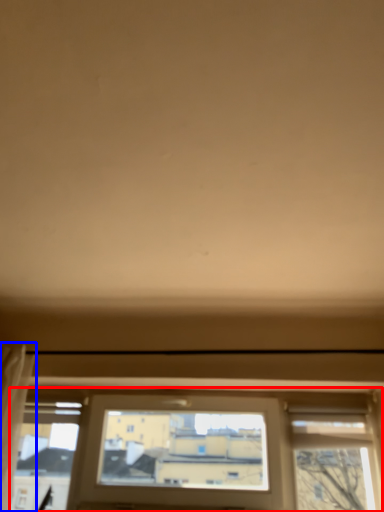
Question: Which of the following is the farthest to the observer, window (highlighted by a red box) or curtain (highlighted by a blue box)?

Choices:
 (A) window
 (B) curtain

Answer: (A)